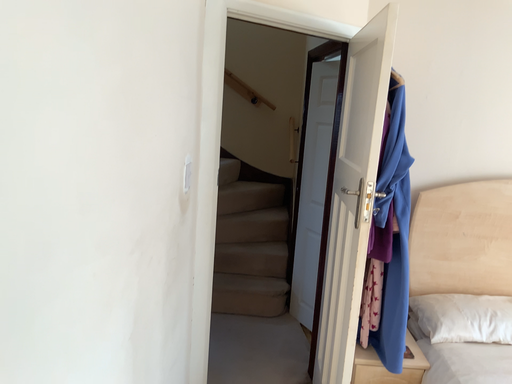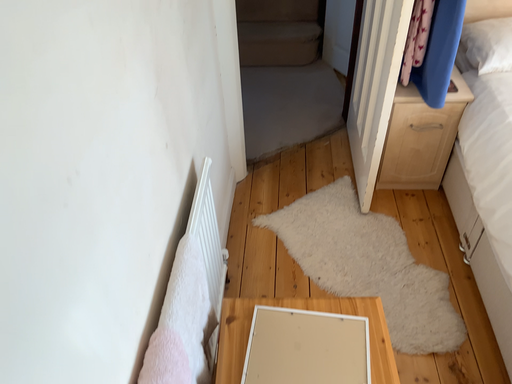
Question: How did the camera likely rotate when shooting the video?

Choices:
 (A) rotated downward
 (B) rotated upward

Answer: (A)